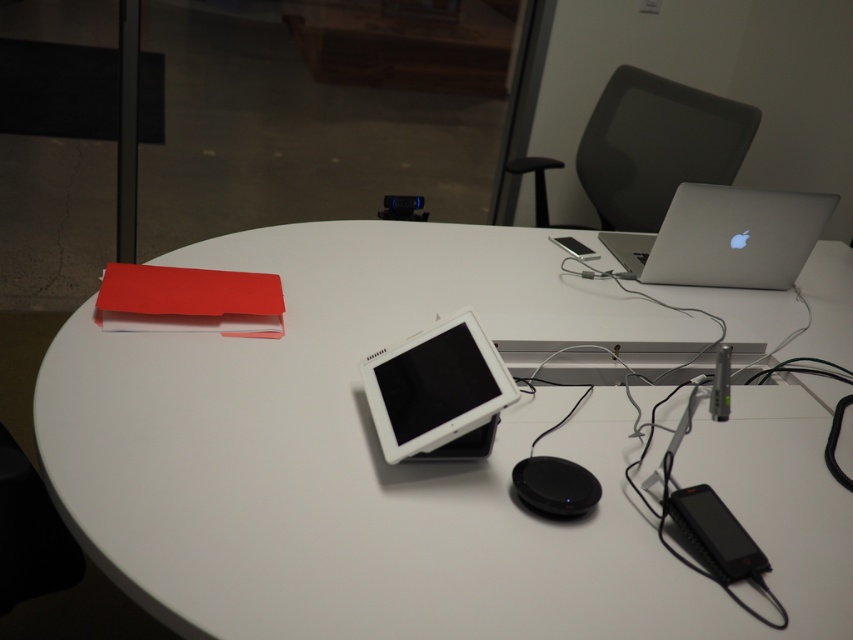
Question: Which point appears closest to the camera in this image?

Choices:
 (A) (398, 268)
 (B) (657, 250)
 (C) (379, 371)

Answer: (C)

Question: Among these points, which one is nearest to the camera?

Choices:
 (A) (758, 230)
 (B) (115, 468)

Answer: (B)

Question: Considering the relative positions of white glossy table at upper left and silver metallic laptop at upper right in the image provided, where is white glossy table at upper left located with respect to silver metallic laptop at upper right?

Choices:
 (A) below
 (B) above

Answer: (A)

Question: Can you confirm if white glossy table at upper left is positioned below silver metallic laptop at upper right?

Choices:
 (A) no
 (B) yes

Answer: (B)

Question: From the image, what is the correct spatial relationship of white glossy table at upper left in relation to silver metallic laptop at upper right?

Choices:
 (A) left
 (B) right

Answer: (A)

Question: Considering the real-world distances, which object is farthest from the white glossy table at upper left?

Choices:
 (A) silver metallic laptop at upper right
 (B) white glossy tablet at center

Answer: (A)